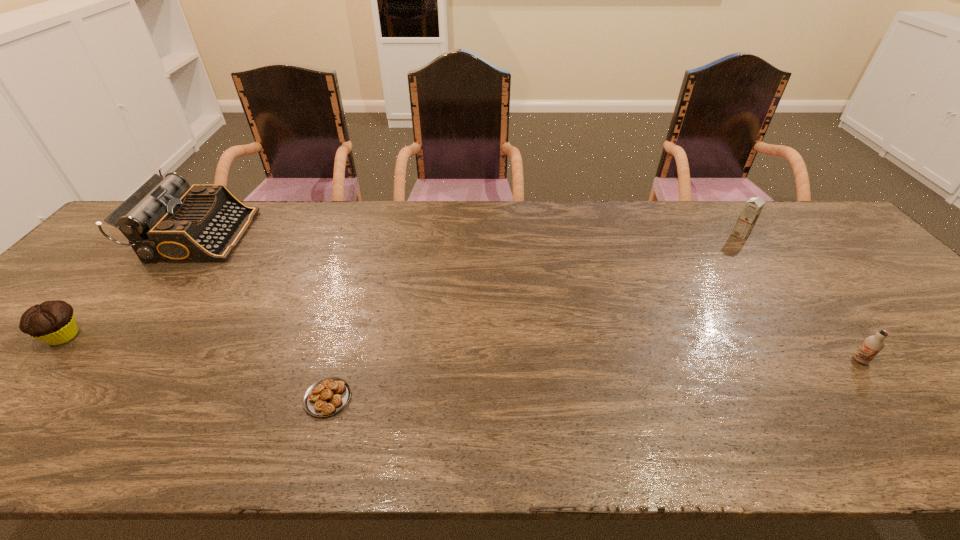
Locate an element on the screen. The image size is (960, 540). vacant space at the near edge of the desktop is located at coordinates (671, 428).

In the image, there is a desktop. Identify the location of vacant space at the left edge. The height and width of the screenshot is (540, 960). (95, 273).

Where is `vacant region at the right edge of the desktop`? Image resolution: width=960 pixels, height=540 pixels. vacant region at the right edge of the desktop is located at coordinates click(845, 247).

In the image, there is a desktop. In order to click on vacant space at the far left corner in this screenshot , I will do `click(125, 246)`.

I want to click on free space at the far right corner of the desktop, so point(801,216).

Identify the location of free space that is in between the nearer chocolate milk and the farther chocolate milk. (801, 297).

Image resolution: width=960 pixels, height=540 pixels. I want to click on vacant space that is in between the pastry and the typewriter, so click(264, 316).

Locate an element on the screen. This screenshot has height=540, width=960. unoccupied area between the right chocolate milk and the typewriter is located at coordinates (530, 298).

Locate an element on the screen. free space between the nearest object and the rightmost object is located at coordinates (594, 379).

At what (x,y) coordinates should I click in order to perform the action: click on free space between the third farthest object and the farther chocolate milk. Please return your answer as a coordinate pair (x, y). Image resolution: width=960 pixels, height=540 pixels. Looking at the image, I should click on (402, 285).